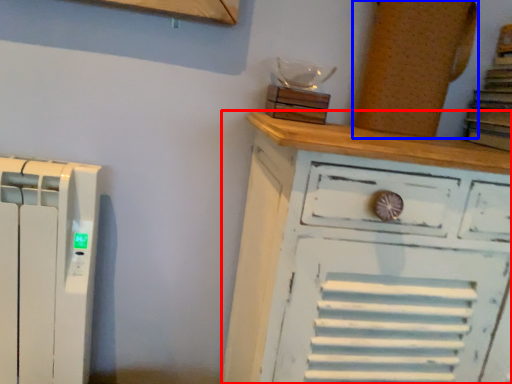
Question: Which point is closer to the camera, chest of drawers (highlighted by a red box) or wood (highlighted by a blue box)?

Choices:
 (A) chest of drawers
 (B) wood

Answer: (A)